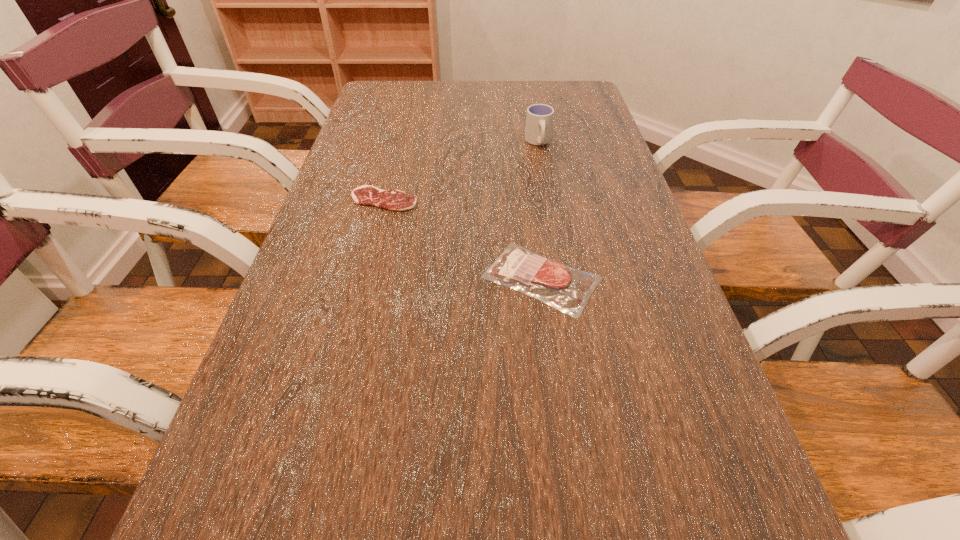
Where is `object at the right edge`? The height and width of the screenshot is (540, 960). object at the right edge is located at coordinates (567, 289).

You are a GUI agent. You are given a task and a screenshot of the screen. Output one action in this format:
    pyautogui.click(x=<x>, y=<y>)
    Task: Click on the vacant space at the far edge of the desktop
    Image resolution: width=960 pixels, height=540 pixels.
    Given the screenshot: What is the action you would take?
    pyautogui.click(x=489, y=109)

Locate an element on the screen. The image size is (960, 540). free space at the left edge is located at coordinates (363, 131).

Find the location of a particular element. free space at the right edge of the desktop is located at coordinates (639, 356).

This screenshot has height=540, width=960. Find the location of `vacant space at the far right corner of the desktop`. vacant space at the far right corner of the desktop is located at coordinates (588, 100).

Locate an element on the screen. This screenshot has width=960, height=540. vacant space that's between the nearest object and the shortest object is located at coordinates (463, 239).

At what (x,y) coordinates should I click in order to perform the action: click on free spot between the farthest object and the shortest object. Please return your answer as a coordinate pair (x, y). Image resolution: width=960 pixels, height=540 pixels. Looking at the image, I should click on (461, 171).

Where is `free area in between the farthest object and the nearest object`? free area in between the farthest object and the nearest object is located at coordinates (540, 211).

Find the location of a particular element. The height and width of the screenshot is (540, 960). free space that is in between the right steak and the cup is located at coordinates (540, 211).

Find the location of a particular element. The height and width of the screenshot is (540, 960). empty space between the nearer steak and the shortest object is located at coordinates (463, 239).